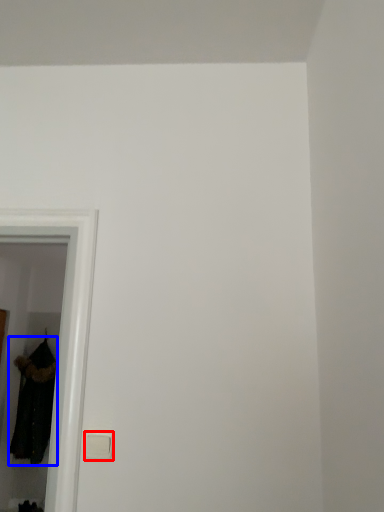
Question: Among these objects, which one is nearest to the camera, light switch (highlighted by a red box) or clothing (highlighted by a blue box)?

Choices:
 (A) light switch
 (B) clothing

Answer: (A)